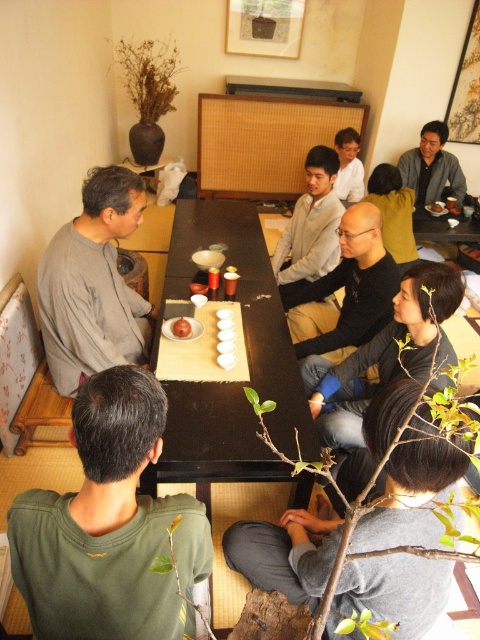
Question: Which of the following is the farthest from the observer?

Choices:
 (A) matte gray sweater at upper right
 (B) black wood table at center
 (C) matte gray shirt at upper right
 (D) light gray sweater at center

Answer: (A)

Question: Is light gray sweater at center to the right of white glossy bowl at center from the viewer's perspective?

Choices:
 (A) yes
 (B) no

Answer: (A)

Question: Which object is closer to the camera taking this photo?

Choices:
 (A) black wood table at center
 (B) gray cotton shirt at left

Answer: (A)

Question: Which point is closer to the camera?

Choices:
 (A) black matte shirt at center
 (B) matte gray sweater at upper right

Answer: (A)

Question: Is matte gray shirt at upper right thinner than smooth brown bowl at upper center?

Choices:
 (A) no
 (B) yes

Answer: (A)

Question: Is black matte shirt at center to the right of matte gray sweater at upper right from the viewer's perspective?

Choices:
 (A) yes
 (B) no

Answer: (B)